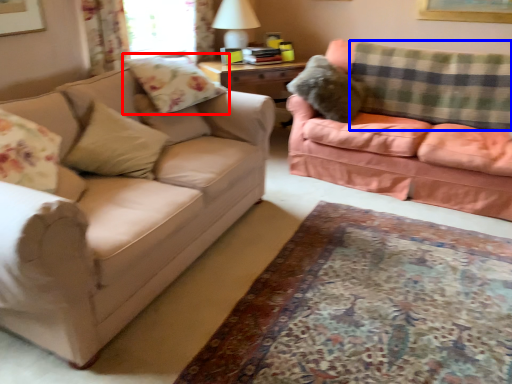
Question: Which object is closer to the camera taking this photo, pillow (highlighted by a red box) or plaid (highlighted by a blue box)?

Choices:
 (A) pillow
 (B) plaid

Answer: (A)